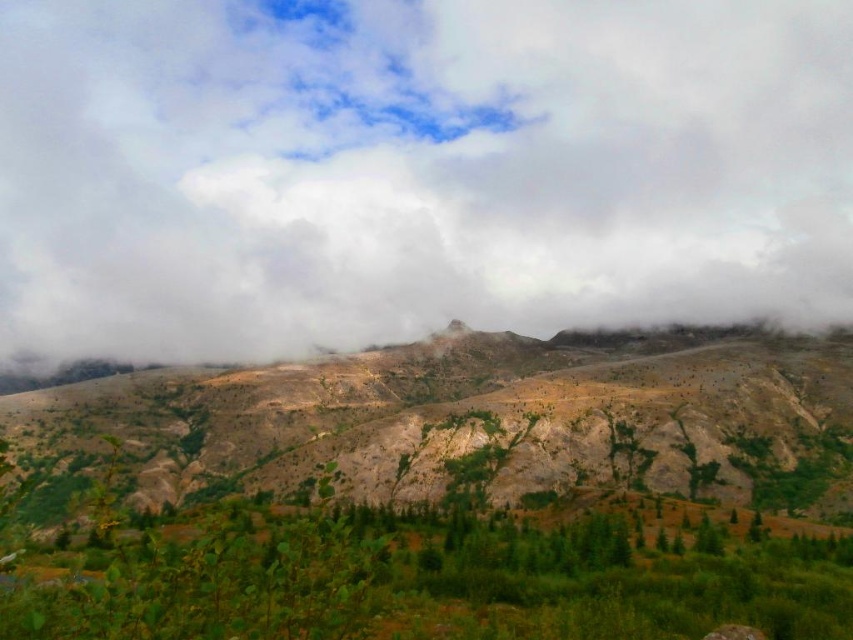
Question: Does white fluffy cloud at upper center have a lesser width compared to rugged stone mountain at center?

Choices:
 (A) yes
 (B) no

Answer: (B)

Question: Which point appears closest to the camera in this image?

Choices:
 (A) click(x=848, y=132)
 (B) click(x=714, y=461)

Answer: (B)

Question: Which point is closer to the camera taking this photo?

Choices:
 (A) (509, 440)
 (B) (117, 332)

Answer: (A)

Question: Is white fluffy cloud at upper center bigger than rugged stone mountain at center?

Choices:
 (A) yes
 (B) no

Answer: (A)

Question: Can you confirm if white fluffy cloud at upper center is positioned below rugged stone mountain at center?

Choices:
 (A) yes
 (B) no

Answer: (B)